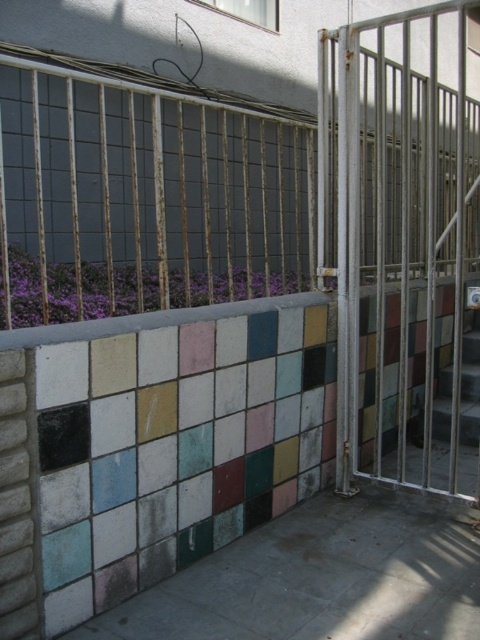
Question: Is rusty metal fence at center smaller than metallic gate at right?

Choices:
 (A) yes
 (B) no

Answer: (B)

Question: Considering the relative positions of rusty metal fence at center and metallic gate at right in the image provided, where is rusty metal fence at center located with respect to metallic gate at right?

Choices:
 (A) left
 (B) right

Answer: (A)

Question: Which object is farther from the camera taking this photo?

Choices:
 (A) metallic gate at right
 (B) rusty metal fence at center

Answer: (A)

Question: Which point is farther to the camera?

Choices:
 (A) (305, 273)
 (B) (392, 195)

Answer: (A)

Question: Does rusty metal fence at center lie behind metallic gate at right?

Choices:
 (A) no
 (B) yes

Answer: (A)